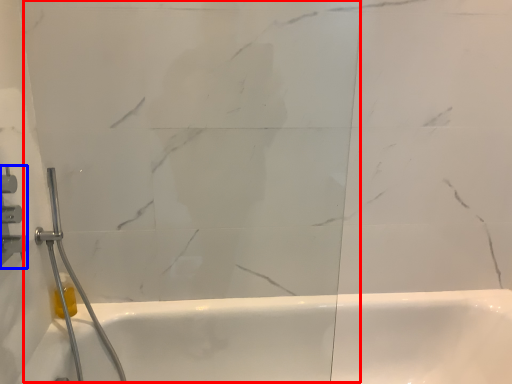
Question: Among these objects, which one is farthest to the camera, glass door (highlighted by a red box) or shower (highlighted by a blue box)?

Choices:
 (A) glass door
 (B) shower

Answer: (B)